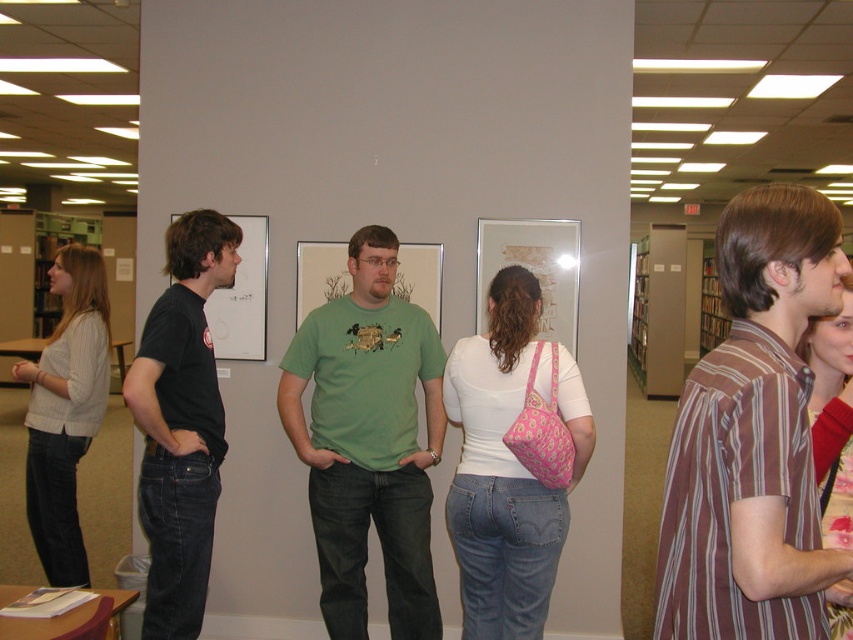
Can you confirm if green matte t-shirt at center is positioned below white matte shirt at center?

Incorrect, green matte t-shirt at center is not positioned below white matte shirt at center.

Between point (399, 320) and point (511, 296), which one is positioned behind?

The point (399, 320) is behind.

Which is behind, point (393, 296) or point (546, 490)?

Point (393, 296)

Locate an element on the screen. The image size is (853, 640). green matte t-shirt at center is located at coordinates (368, 440).

Can you confirm if white matte shirt at center is bigger than floral fabric purse at center?

Yes, white matte shirt at center is bigger than floral fabric purse at center.

Between white matte shirt at center and floral fabric purse at center, which one has more height?

With more height is white matte shirt at center.

Is point (495, 634) farther from viewer compared to point (844, 403)?

Yes, point (495, 634) is farther from viewer.

Find the location of `white matte shirt at center`. white matte shirt at center is located at coordinates (508, 465).

Between black cotton t-shirt at left and floral fabric purse at center, which one appears on the left side from the viewer's perspective?

Positioned to the left is black cotton t-shirt at left.

Looking at this image, is black cotton t-shirt at left above floral fabric purse at center?

Incorrect, black cotton t-shirt at left is not positioned above floral fabric purse at center.

Who is more forward, (181, 232) or (850, 392)?

Point (850, 392) is in front.

Locate an element on the screen. This screenshot has height=640, width=853. black cotton t-shirt at left is located at coordinates (181, 422).